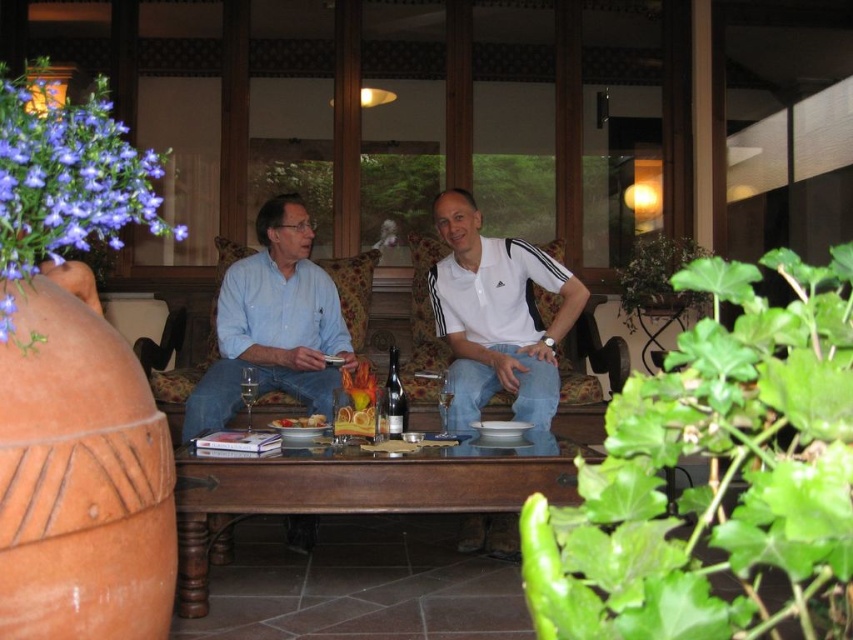
Can you confirm if white cotton polo shirt at center is wider than matte blue shirt at center?

Correct, the width of white cotton polo shirt at center exceeds that of matte blue shirt at center.

Who is shorter, white cotton polo shirt at center or matte blue shirt at center?

white cotton polo shirt at center is shorter.

Find the location of a particular element. Image resolution: width=853 pixels, height=640 pixels. white cotton polo shirt at center is located at coordinates (497, 316).

Describe the element at coordinates (497, 316) in the screenshot. This screenshot has height=640, width=853. I see `matte white shirt at center` at that location.

Who is taller, matte white shirt at center or smooth orange bowl at center?

matte white shirt at center is taller.

Measure the distance between point (469, 301) and camera.

The distance of point (469, 301) from camera is 10.51 feet.

Image resolution: width=853 pixels, height=640 pixels. I want to click on matte white shirt at center, so click(497, 316).

Find the location of a particular element. This screenshot has height=640, width=853. brown wooden table at center is located at coordinates click(361, 490).

Between brown wooden table at center and matte white shirt at center, which one appears on the right side from the viewer's perspective?

From the viewer's perspective, matte white shirt at center appears more on the right side.

Is point (460, 448) positioned after point (461, 372)?

No, (460, 448) is in front of (461, 372).

Where is `brown wooden table at center`? brown wooden table at center is located at coordinates (361, 490).